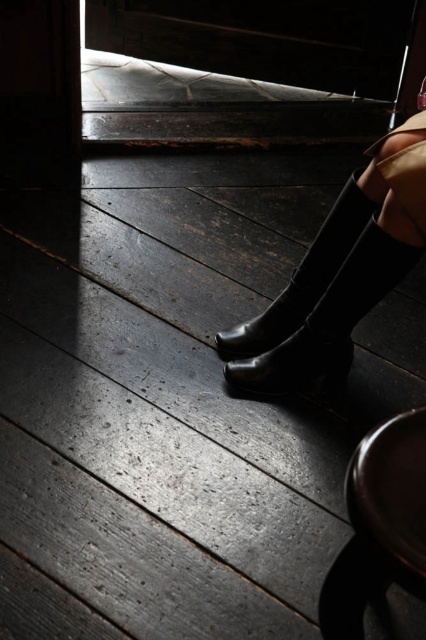
Between black leather boots at lower right and rubber matte boot at center, which one appears on the right side from the viewer's perspective?

Positioned to the right is black leather boots at lower right.

Who is taller, black leather boots at lower right or rubber matte boot at center?

black leather boots at lower right

Identify the location of black leather boots at lower right. Image resolution: width=426 pixels, height=640 pixels. (331, 284).

Between point (244, 387) and point (363, 260), which one is positioned behind?

Point (244, 387)

Can you confirm if black leather boots at lower right is wider than shiny black boot at center?

Yes, black leather boots at lower right is wider than shiny black boot at center.

What are the coordinates of `black leather boots at lower right` in the screenshot? It's located at pyautogui.click(x=331, y=284).

Is shiny black boot at center shorter than rubber matte boot at center?

Yes, shiny black boot at center is shorter than rubber matte boot at center.

Which is behind, point (249, 324) or point (344, 212)?

Positioned behind is point (249, 324).

From the picture: Who is more distant from viewer, (233, 378) or (328, 259)?

Point (233, 378)

The width and height of the screenshot is (426, 640). In order to click on shiny black boot at center in this screenshot , I will do `click(330, 317)`.